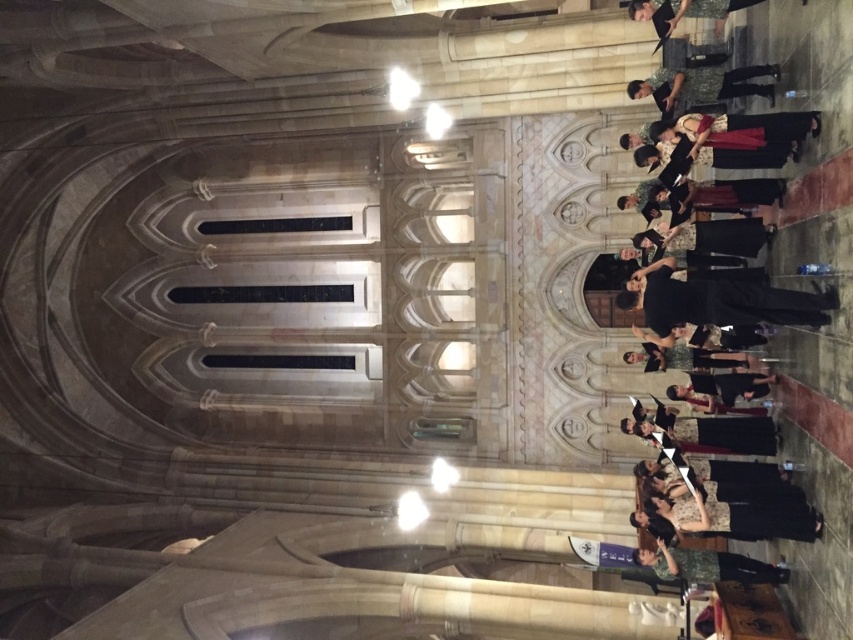
Does black satin dress at right come in front of camouflage-patterned shirt at lower right?

That is True.

What do you see at coordinates (810, 289) in the screenshot? This screenshot has width=853, height=640. I see `black satin dress at right` at bounding box center [810, 289].

Who is more forward, (810, 19) or (654, 554)?

Positioned in front is point (810, 19).

Locate an element on the screen. The width and height of the screenshot is (853, 640). black satin dress at right is located at coordinates (810, 289).

Can you confirm if black satin dress at right is shorter than camouflage-patterned shirt at upper center?

No.

From the picture: Is black satin dress at right smaller than camouflage-patterned shirt at upper center?

Incorrect, black satin dress at right is not smaller in size than camouflage-patterned shirt at upper center.

Where is `black satin dress at right`? Image resolution: width=853 pixels, height=640 pixels. black satin dress at right is located at coordinates (810, 289).

Does camouflage-patterned shirt at upper center have a greater height compared to camouflage-patterned shirt at lower right?

Correct, camouflage-patterned shirt at upper center is much taller as camouflage-patterned shirt at lower right.

Does camouflage-patterned shirt at upper center have a greater width compared to camouflage-patterned shirt at lower right?

Indeed, camouflage-patterned shirt at upper center has a greater width compared to camouflage-patterned shirt at lower right.

Which is in front, point (648, 80) or point (734, 561)?

Point (734, 561) is in front.

Locate an element on the screen. camouflage-patterned shirt at upper center is located at coordinates (701, 84).